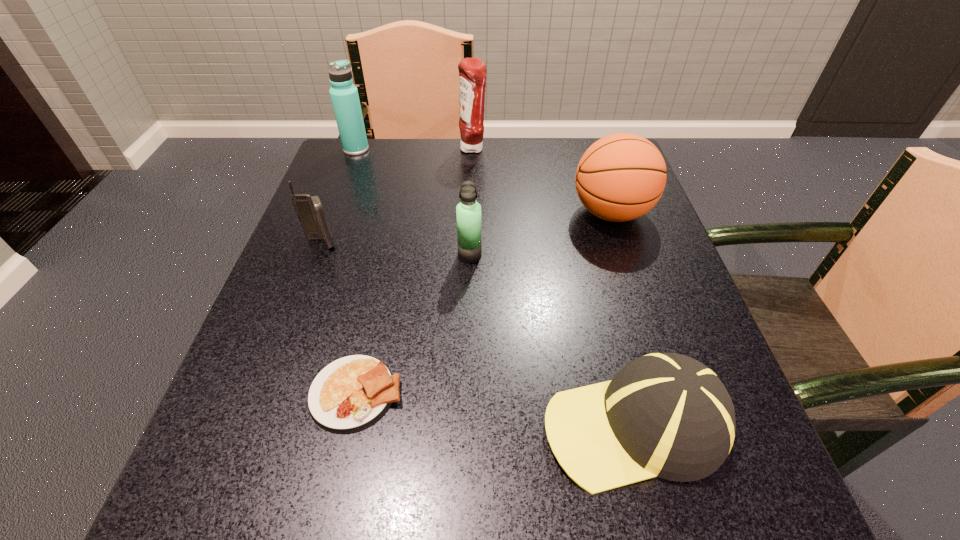
The width and height of the screenshot is (960, 540). Identify the location of object located at the near right corner. (667, 415).

The image size is (960, 540). I want to click on free space at the far edge of the desktop, so click(x=540, y=181).

I want to click on vacant space at the left edge, so click(359, 193).

Identify the location of vacant space at the right edge of the desktop. The width and height of the screenshot is (960, 540). (685, 306).

What are the coordinates of `vacant point at the far left corner` in the screenshot? It's located at (376, 144).

The image size is (960, 540). Identify the location of vacant area that lies between the taller thermos bottle and the second shortest object. (495, 287).

You are a GUI agent. You are given a task and a screenshot of the screen. Output one action in this format:
    pyautogui.click(x=<x>, y=<y>)
    Task: Click on the vacant area that lies between the basketball and the sixth tallest object
    Image resolution: width=960 pixels, height=540 pixels.
    Given the screenshot: What is the action you would take?
    pyautogui.click(x=622, y=319)

Locate an element on the screen. free spot between the omelet and the fifth tallest object is located at coordinates (339, 318).

I want to click on free space that is in between the basketball and the third object from left to right, so click(x=484, y=303).

Locate an element on the screen. The height and width of the screenshot is (540, 960). blank region between the baseball cap and the right thermos bottle is located at coordinates (552, 340).